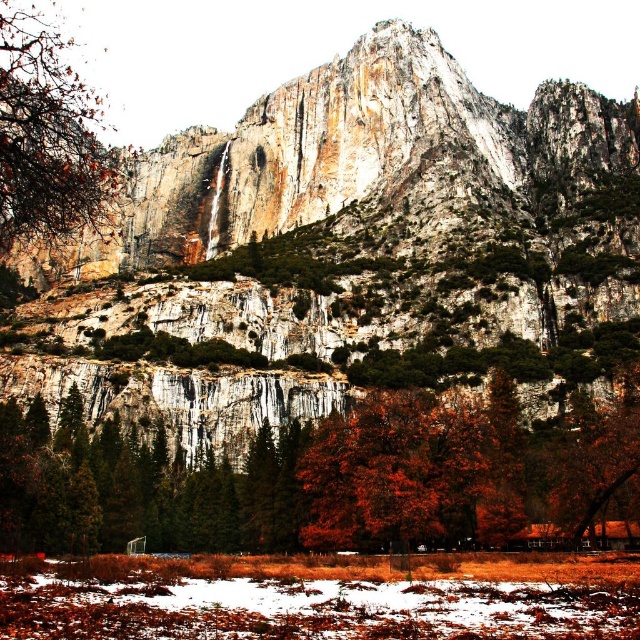
Does point (326, 301) come closer to viewer compared to point (113, 180)?

Yes, it is in front of point (113, 180).

Can you confirm if rocky cliff at center is shorter than smooth brown tree trunk at left?

Incorrect, rocky cliff at center's height does not fall short of smooth brown tree trunk at left's.

Find the location of a particular element. Image resolution: width=640 pixels, height=640 pixels. rocky cliff at center is located at coordinates (369, 211).

Locate an element on the screen. The height and width of the screenshot is (640, 640). rocky cliff at center is located at coordinates (369, 211).

This screenshot has height=640, width=640. Describe the element at coordinates (316, 477) in the screenshot. I see `orange leafy tree at center` at that location.

Is orange leafy tree at center wider than smooth brown tree trunk at left?

Yes, orange leafy tree at center is wider than smooth brown tree trunk at left.

At what (x,y) coordinates should I click in order to perform the action: click on orange leafy tree at center. Please return your answer as a coordinate pair (x, y). This screenshot has width=640, height=640. Looking at the image, I should click on (316, 477).

You are a GUI agent. You are given a task and a screenshot of the screen. Output one action in this format:
    pyautogui.click(x=<x>, y=<y>)
    Task: Click on the orange leafy tree at center
    This screenshot has height=640, width=640.
    Given the screenshot: What is the action you would take?
    pyautogui.click(x=316, y=477)

Does point (304, 154) lie in front of point (292, 532)?

No.

Is point (346, 237) farther from viewer compared to point (88, 481)?

Yes.

Image resolution: width=640 pixels, height=640 pixels. In order to click on rocky cliff at center in this screenshot , I will do `click(369, 211)`.